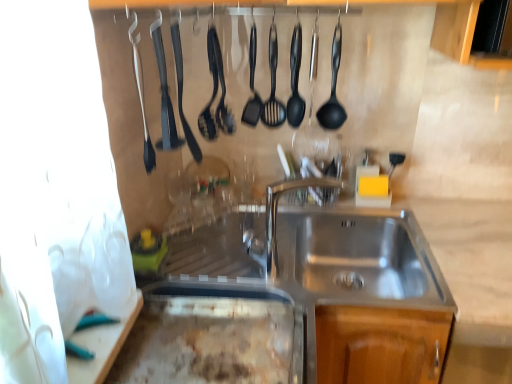
Find the location of a particular element. black rubber spatula at center, which appears as the 1th utensil when viewed from the left is located at coordinates (221, 86).

Find the location of a particular element. This screenshot has height=384, width=512. black rubber spatula at upper center, the 1th silverware in the right-to-left sequence is located at coordinates (182, 92).

The height and width of the screenshot is (384, 512). Describe the element at coordinates (141, 96) in the screenshot. I see `black rubber spatula at upper left, the first silverware when ordered from left to right` at that location.

Identify the location of black plastic spatula at center, which is counted as the 2th utensil, starting from the right. (252, 85).

You are a GUI agent. You are given a task and a screenshot of the screen. Output one action in this format:
    pyautogui.click(x=<x>, y=<y>)
    Task: Click on the black rubber spatula at center, which is the third utensil from right to left
    The image size is (512, 384).
    Given the screenshot: What is the action you would take?
    pyautogui.click(x=221, y=86)

Which of these two, black plastic spatula at center, which is counted as the 2th utensil, starting from the right, or black rubber spatula at center, which appears as the 1th utensil when viewed from the left, is thinner?

black plastic spatula at center, which is counted as the 2th utensil, starting from the right.

In the scene shown: Who is taller, black plastic spatula at center, which is counted as the 2th utensil, starting from the right, or black rubber spatula at center, which appears as the 1th utensil when viewed from the left?

With more height is black rubber spatula at center, which appears as the 1th utensil when viewed from the left.

Locate an element on the screen. Image resolution: width=512 pixels, height=384 pixels. utensil on the left of black plastic spatula at center, which is counted as the 2th utensil, starting from the right is located at coordinates (221, 86).

Considering the relative sizes of black plastic spatula at center, which appears as the 1th utensil when viewed from the right, and black plastic spatula at center, which is counted as the 2th utensil, starting from the right, in the image provided, is black plastic spatula at center, which appears as the 1th utensil when viewed from the right, smaller than black plastic spatula at center, which is counted as the 2th utensil, starting from the right,?

Incorrect, black plastic spatula at center, which appears as the 1th utensil when viewed from the right, is not smaller in size than black plastic spatula at center, which is counted as the 2th utensil, starting from the right.

Is the position of black plastic spatula at center, which appears as the 1th utensil when viewed from the right, more distant than that of black plastic spatula at center, which is counted as the 2th utensil, starting from the right?

No, black plastic spatula at center, which appears as the 1th utensil when viewed from the right, is closer to the viewer.

From a real-world perspective, starting from the black plastic spatula at center, which appears as the 1th utensil when viewed from the right, which utensil is the 2nd one vertically above it? Please provide its 2D coordinates.

[(252, 85)]

Could you tell me if polished stainless steel faucet at center is turned towards black plastic spatula at center, which appears as the 1th utensil when viewed from the right?

No, polished stainless steel faucet at center is not turned towards black plastic spatula at center, which appears as the 1th utensil when viewed from the right.

Does polished stainless steel faucet at center have a lesser width compared to black plastic spatula at center, the 3th utensil in the left-to-right sequence?

Yes.

At what (x,y) coordinates should I click in order to perform the action: click on faucet below the black plastic spatula at center, which appears as the 1th utensil when viewed from the right (from a real-world perspective). Please return your answer as a coordinate pair (x, y). This screenshot has width=512, height=384. Looking at the image, I should click on (277, 206).

Looking at this image, is polished stainless steel faucet at center taller or shorter than black plastic spatula at center, the 3th utensil in the left-to-right sequence?

Considering their sizes, polished stainless steel faucet at center has less height than black plastic spatula at center, the 3th utensil in the left-to-right sequence.

From the image's perspective, which is below, black rubber spatula at center, which is the third utensil from right to left, or black plastic spatula at center, which is counted as the 2th utensil, starting from the right?

black rubber spatula at center, which is the third utensil from right to left, from the image's perspective.

Considering the sizes of objects black rubber spatula at center, which is the third utensil from right to left, and black plastic spatula at center, which is counted as the 2th utensil, starting from the right, in the image provided, who is bigger, black rubber spatula at center, which is the third utensil from right to left, or black plastic spatula at center, which is counted as the 2th utensil, starting from the right,?

Bigger between the two is black rubber spatula at center, which is the third utensil from right to left.

Based on the photo, are black rubber spatula at center, which appears as the 1th utensil when viewed from the left, and black plastic spatula at center, which is counted as the 2th utensil, starting from the right, beside each other?

There is a gap between black rubber spatula at center, which appears as the 1th utensil when viewed from the left, and black plastic spatula at center, which is counted as the 2th utensil, starting from the right.

Is black rubber spatula at center, which is the third utensil from right to left, facing towards black plastic spatula at center, which is counted as the 2th utensil, starting from the right?

No, black rubber spatula at center, which is the third utensil from right to left, is not oriented towards black plastic spatula at center, which is counted as the 2th utensil, starting from the right.

You are a GUI agent. You are given a task and a screenshot of the screen. Output one action in this format:
    pyautogui.click(x=<x>, y=<y>)
    Task: Click on the 2nd utensil positioned above the black rubber spatula at upper center, acting as the 3th silverware starting from the left (from the image's perspective)
    The height and width of the screenshot is (384, 512).
    Given the screenshot: What is the action you would take?
    pyautogui.click(x=273, y=86)

Is black rubber spatula at upper center, the 1th silverware in the right-to-left sequence, turned away from black plastic spatula at center, the 3th utensil in the left-to-right sequence?

No, black rubber spatula at upper center, the 1th silverware in the right-to-left sequence, is not facing the opposite direction of black plastic spatula at center, the 3th utensil in the left-to-right sequence.

In the scene shown: Is black rubber spatula at upper center, the 1th silverware in the right-to-left sequence, situated inside black plastic spatula at center, which appears as the 1th utensil when viewed from the right, or outside?

The correct answer is: outside.

From the image's perspective, is black rubber spatula at upper center, the 1th silverware in the right-to-left sequence, on black plastic spatula at center, which appears as the 1th utensil when viewed from the right?

No, from the image's perspective, black rubber spatula at upper center, the 1th silverware in the right-to-left sequence, is not above black plastic spatula at center, which appears as the 1th utensil when viewed from the right.

Considering the sizes of objects polished stainless steel faucet at center and black rubber spatula at upper left, the first silverware when ordered from left to right, in the image provided, who is shorter, polished stainless steel faucet at center or black rubber spatula at upper left, the first silverware when ordered from left to right,?

polished stainless steel faucet at center.

Who is bigger, polished stainless steel faucet at center or black rubber spatula at upper left, the first silverware when ordered from left to right?

polished stainless steel faucet at center.

Does point (277, 189) appear closer or farther from the camera than point (151, 150)?

Point (277, 189) is farther from the camera than point (151, 150).

From the picture: Is black plastic spatula at center, the second utensil positioned from the left, taller than black plastic spatula at center, the 3th utensil in the left-to-right sequence?

In fact, black plastic spatula at center, the second utensil positioned from the left, may be shorter than black plastic spatula at center, the 3th utensil in the left-to-right sequence.

Does black plastic spatula at center, which is counted as the 2th utensil, starting from the right, have a greater width compared to black plastic spatula at center, the 3th utensil in the left-to-right sequence?

No.

Is point (247, 101) closer to camera compared to point (277, 125)?

Yes.

Can you confirm if black plastic spatula at center, the second utensil positioned from the left, is positioned to the right of black plastic spatula at center, which appears as the 1th utensil when viewed from the right?

No, black plastic spatula at center, the second utensil positioned from the left, is not to the right of black plastic spatula at center, which appears as the 1th utensil when viewed from the right.

From the black plastic spatula at center, the second utensil positioned from the left, count 2nd utensils forward and point to it. Please provide its 2D coordinates.

[(221, 86)]

The height and width of the screenshot is (384, 512). I want to click on utensil on the right of the black plastic spatula at center, the second utensil positioned from the left, so click(x=273, y=86).

Estimate the real-world distances between objects in this image. Which object is closer to black rubber spatula at upper left, which is the 3th silverware in right-to-left order, black rubber spatula at upper center, acting as the second silverware starting from the right, or black rubber spatula at center, which appears as the 1th utensil when viewed from the left?

Based on the image, black rubber spatula at upper center, acting as the second silverware starting from the right, appears to be nearer to black rubber spatula at upper left, which is the 3th silverware in right-to-left order.

When comparing their distances from black plastic spatula at center, the 3th utensil in the left-to-right sequence, does black rubber spatula at center, which appears as the 1th utensil when viewed from the left, or black rubber spatula at upper center, acting as the 3th silverware starting from the left, seem closer?

Based on the image, black rubber spatula at center, which appears as the 1th utensil when viewed from the left, appears to be nearer to black plastic spatula at center, the 3th utensil in the left-to-right sequence.

Looking at this image, looking at the image, which one is located further to black plastic spatula at center, the second utensil positioned from the left, black plastic spatula at center, the 3th utensil in the left-to-right sequence, or black rubber spatula at upper center, acting as the 3th silverware starting from the left?

Based on the image, black rubber spatula at upper center, acting as the 3th silverware starting from the left, appears to be further to black plastic spatula at center, the second utensil positioned from the left.

Looking at the image, which one is located further to black rubber spatula at upper center, acting as the 3th silverware starting from the left, black plastic spatula at center, which appears as the 1th utensil when viewed from the right, or polished stainless steel faucet at center?

polished stainless steel faucet at center is positioned further to the anchor black rubber spatula at upper center, acting as the 3th silverware starting from the left.

When comparing their distances from black rubber spatula at center, which is the third utensil from right to left, does black rubber spatula at upper center, acting as the second silverware starting from the right, or black plastic spatula at center, which is counted as the 2th utensil, starting from the right, seem closer?

Based on the image, black plastic spatula at center, which is counted as the 2th utensil, starting from the right, appears to be nearer to black rubber spatula at center, which is the third utensil from right to left.

Considering their positions, is black plastic spatula at center, which is counted as the 2th utensil, starting from the right, positioned closer to black rubber spatula at upper center, acting as the second silverware starting from the right, than black rubber spatula at upper left, which is the 3th silverware in right-to-left order?

black rubber spatula at upper left, which is the 3th silverware in right-to-left order, lies closer to black rubber spatula at upper center, acting as the second silverware starting from the right, than the other object.

From the image, which object appears to be farther from polished stainless steel faucet at center, black plastic spatula at center, which is counted as the 2th utensil, starting from the right, or black plastic spatula at center, the 3th utensil in the left-to-right sequence?

black plastic spatula at center, which is counted as the 2th utensil, starting from the right, is positioned further to the anchor polished stainless steel faucet at center.

Looking at this image, considering their positions, is black plastic spatula at center, the second utensil positioned from the left, positioned further to black rubber spatula at upper center, acting as the 3th silverware starting from the left, than black plastic spatula at center, the 3th utensil in the left-to-right sequence?

The object further to black rubber spatula at upper center, acting as the 3th silverware starting from the left, is black plastic spatula at center, the 3th utensil in the left-to-right sequence.

Identify the location of silverware between black rubber spatula at upper left, the first silverware when ordered from left to right, and black rubber spatula at upper center, acting as the 3th silverware starting from the left, along the z-axis. (164, 93).

Where is `silverware situated between black rubber spatula at upper center, acting as the second silverware starting from the right, and black plastic spatula at center, which appears as the 1th utensil when viewed from the right, from left to right`? silverware situated between black rubber spatula at upper center, acting as the second silverware starting from the right, and black plastic spatula at center, which appears as the 1th utensil when viewed from the right, from left to right is located at coordinates (182, 92).

Identify the location of silverware located between black rubber spatula at upper center, placed as the second silverware when sorted from left to right, and black rubber spatula at center, which is the third utensil from right to left, in the depth direction. (182, 92).

Identify the location of silverware between black rubber spatula at upper center, placed as the second silverware when sorted from left to right, and black plastic spatula at center, the second utensil positioned from the left, in the front-back direction. The height and width of the screenshot is (384, 512). (182, 92).